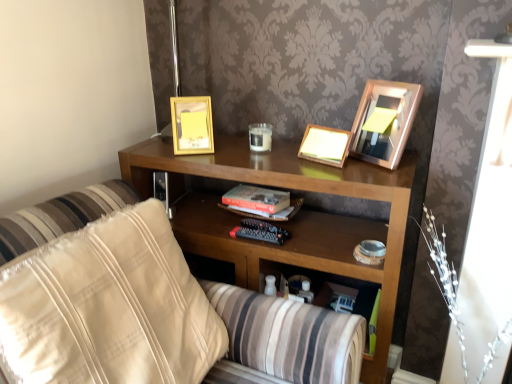
Question: In which direction should I rotate to look at gold metallic picture frame at upper center, acting as the third picture frame starting from the right?

Choices:
 (A) left
 (B) right

Answer: (A)

Question: Does gold metallic picture frame at upper right, the 1th picture frame from the right, come in front of wooden shelf at center?

Choices:
 (A) yes
 (B) no

Answer: (B)

Question: Is gold metallic picture frame at upper right, arranged as the 3th picture frame when viewed from the left, surrounding wooden shelf at center?

Choices:
 (A) no
 (B) yes

Answer: (A)

Question: From the image's perspective, would you say gold metallic picture frame at upper right, the 1th picture frame from the right, is shown under wooden shelf at center?

Choices:
 (A) yes
 (B) no

Answer: (B)

Question: Would you consider gold metallic picture frame at upper right, arranged as the 3th picture frame when viewed from the left, to be distant from wooden shelf at center?

Choices:
 (A) yes
 (B) no

Answer: (B)

Question: Could you tell me if gold metallic picture frame at upper right, arranged as the 3th picture frame when viewed from the left, is turned towards wooden shelf at center?

Choices:
 (A) no
 (B) yes

Answer: (A)

Question: Considering the relative sizes of gold metallic picture frame at upper right, arranged as the 3th picture frame when viewed from the left, and wooden shelf at center in the image provided, is gold metallic picture frame at upper right, arranged as the 3th picture frame when viewed from the left, thinner than wooden shelf at center?

Choices:
 (A) yes
 (B) no

Answer: (A)

Question: Is wooden picture frame at center, the second picture frame viewed from the right, facing towards gold metallic picture frame at upper center, acting as the third picture frame starting from the right?

Choices:
 (A) yes
 (B) no

Answer: (B)

Question: From the image's perspective, is wooden picture frame at center, which is counted as the 2th picture frame, starting from the left, over gold metallic picture frame at upper center, acting as the third picture frame starting from the right?

Choices:
 (A) yes
 (B) no

Answer: (B)

Question: Does wooden picture frame at center, the second picture frame viewed from the right, have a lesser width compared to gold metallic picture frame at upper center, acting as the third picture frame starting from the right?

Choices:
 (A) yes
 (B) no

Answer: (A)

Question: Is wooden picture frame at center, which is counted as the 2th picture frame, starting from the left, not close to gold metallic picture frame at upper center, which ranks as the 1th picture frame in left-to-right order?

Choices:
 (A) no
 (B) yes

Answer: (A)

Question: Is gold metallic picture frame at upper center, acting as the third picture frame starting from the right, at the back of wooden picture frame at center, the second picture frame viewed from the right?

Choices:
 (A) yes
 (B) no

Answer: (B)

Question: Is wooden picture frame at center, the second picture frame viewed from the right, surrounding gold metallic picture frame at upper center, acting as the third picture frame starting from the right?

Choices:
 (A) yes
 (B) no

Answer: (B)

Question: Is wooden shelf at center to the left of wooden picture frame at center, the second picture frame viewed from the right, from the viewer's perspective?

Choices:
 (A) no
 (B) yes

Answer: (B)